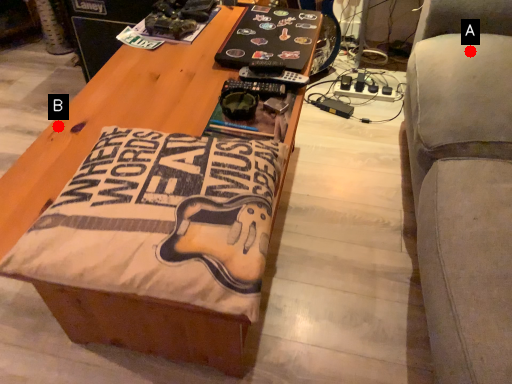
Question: Two points are circled on the image, labeled by A and B beside each circle. Which point appears closest to the camera in this image?

Choices:
 (A) A is closer
 (B) B is closer

Answer: (B)